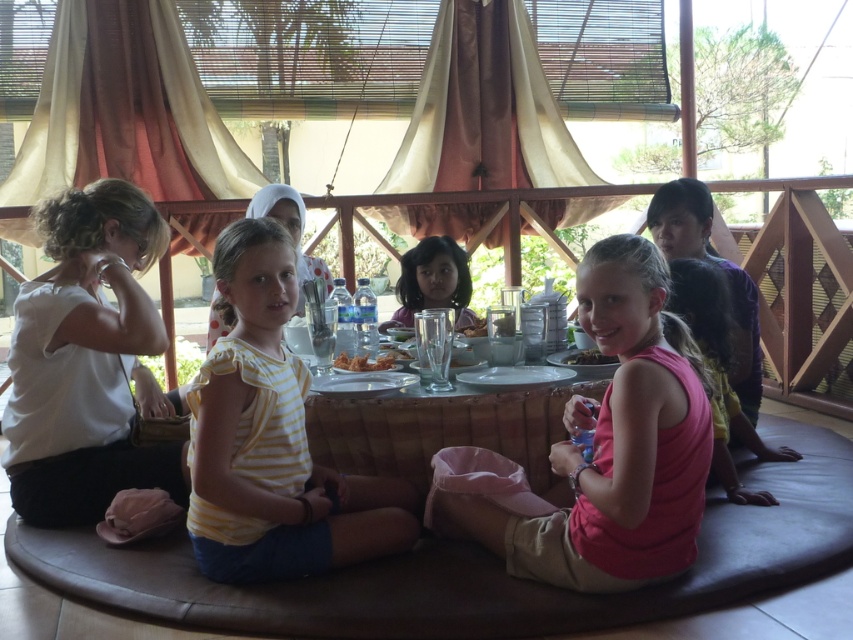
Consider the image. You are a photographer standing at the entrance of the dining area. You want to take a photo of the yellow striped shirt at center. Based on its coordinates, where should you aim your camera?

The yellow striped shirt at center is located at coordinates point (271,440), so you should aim your camera towards that position to capture it.

You are a photographer trying to capture a photo of the children at the table. You notice two children wearing the yellow striped shirt at center and the pink fabric dress at center. Which child should you focus on first to ensure they are in sharp focus if you want both in the same frame?

You should focus on the yellow striped shirt at center first because it is closer to the viewer than the pink fabric dress at center. By focusing on the closer subject, the depth of field may still keep the farther one in acceptable focus.

From the picture: You are a photographer trying to capture a photo of the children around the table. You want to ensure that both the pink fabric dress at center and the translucent glass cup at center are clearly visible in the shot. Based on their positions, which object should you focus on first to ensure both are in focus?

The pink fabric dress at center is located below the translucent glass cup at center. To ensure both are in focus, you should focus on the translucent glass cup at center first since it is closer to the camera, and the dress will naturally be in focus as it is behind the cup.